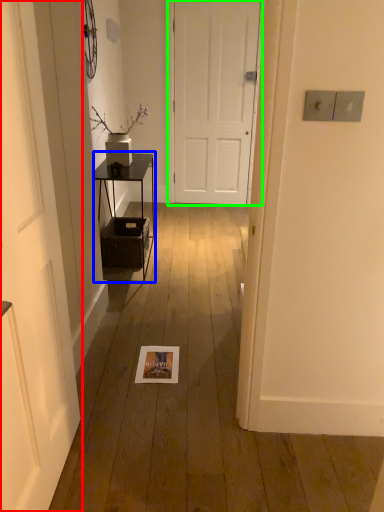
Question: Which object is the farthest from door (highlighted by a red box)? Choose among these: table (highlighted by a blue box) or door (highlighted by a green box).

Choices:
 (A) table
 (B) door

Answer: (B)